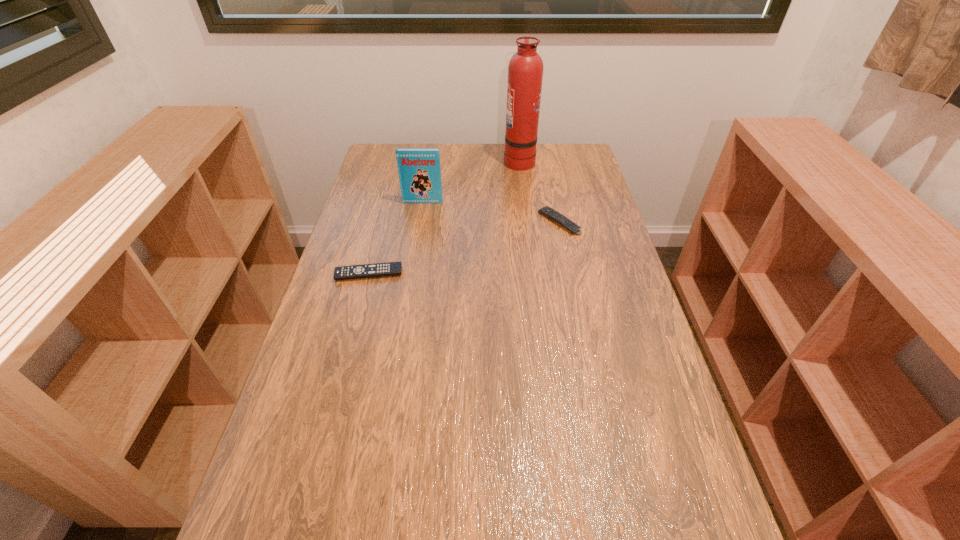
At what (x,y) coordinates should I click in order to perform the action: click on the farthest object. Please return your answer as a coordinate pair (x, y). This screenshot has height=540, width=960. Looking at the image, I should click on (525, 71).

Identify the location of fire extinguisher. (525, 71).

Locate an element on the screen. This screenshot has width=960, height=540. the third nearest object is located at coordinates (419, 170).

Locate an element on the screen. book is located at coordinates (419, 170).

The width and height of the screenshot is (960, 540). Identify the location of the right remote control. (546, 211).

This screenshot has height=540, width=960. I want to click on the third farthest object, so click(x=546, y=211).

The width and height of the screenshot is (960, 540). In order to click on the nearer remote control in this screenshot , I will do `click(391, 268)`.

Identify the location of the nearest object. The height and width of the screenshot is (540, 960). (391, 268).

You are a GUI agent. You are given a task and a screenshot of the screen. Output one action in this format:
    pyautogui.click(x=<x>, y=<y>)
    Task: Click on the free space located on the label side of the fire extinguisher
    The height and width of the screenshot is (540, 960).
    Given the screenshot: What is the action you would take?
    pyautogui.click(x=475, y=160)

At what (x,y) coordinates should I click in order to perform the action: click on free region located on the label side of the fire extinguisher. Please return your answer as a coordinate pair (x, y). This screenshot has height=540, width=960. Looking at the image, I should click on (431, 160).